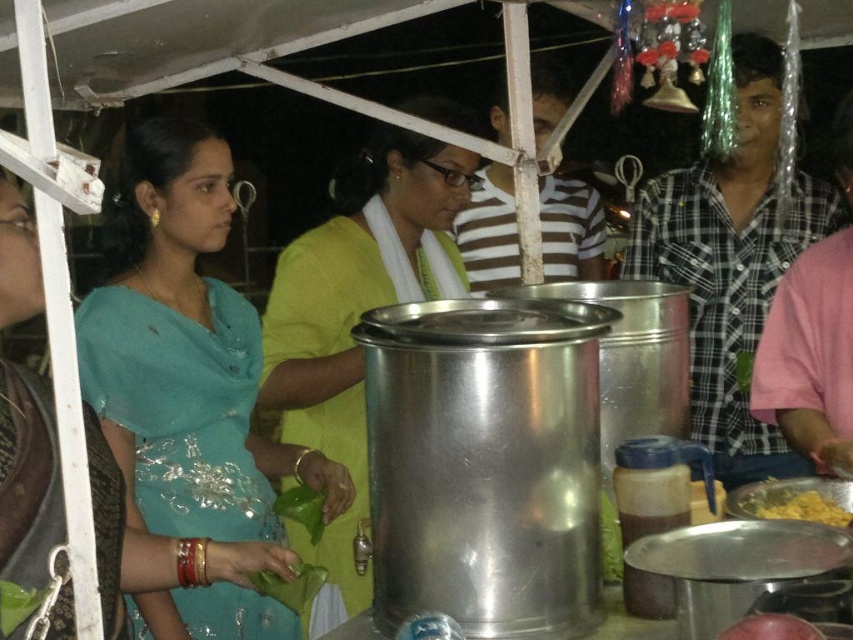
You are a customer at this food stall and you want to place a smooth red apple at center on top of the checkered fabric shirt at right. Will the apple fit on the shirt without hanging off the edges?

The checkered fabric shirt at right is wider than the smooth red apple at center, so the apple will fit on the shirt without hanging off the edges.